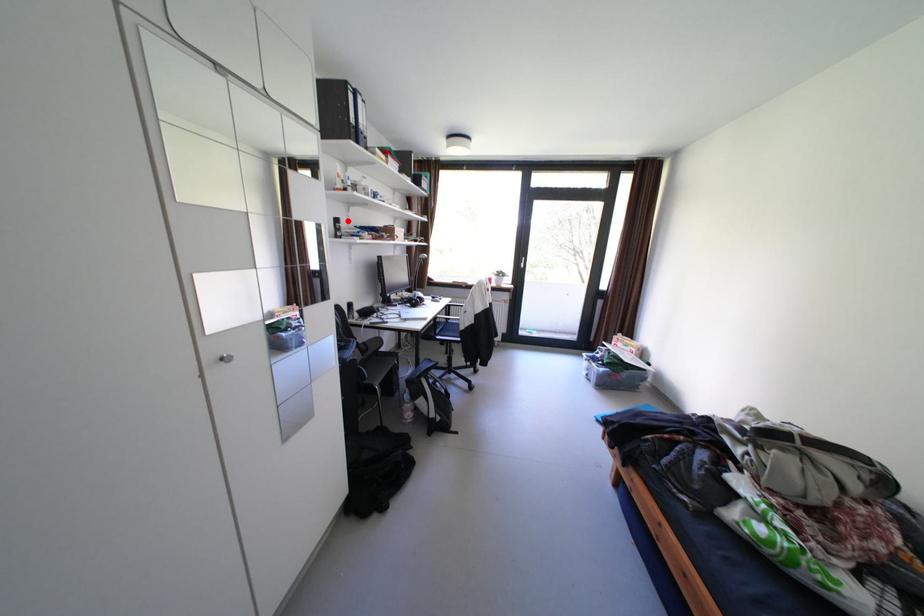
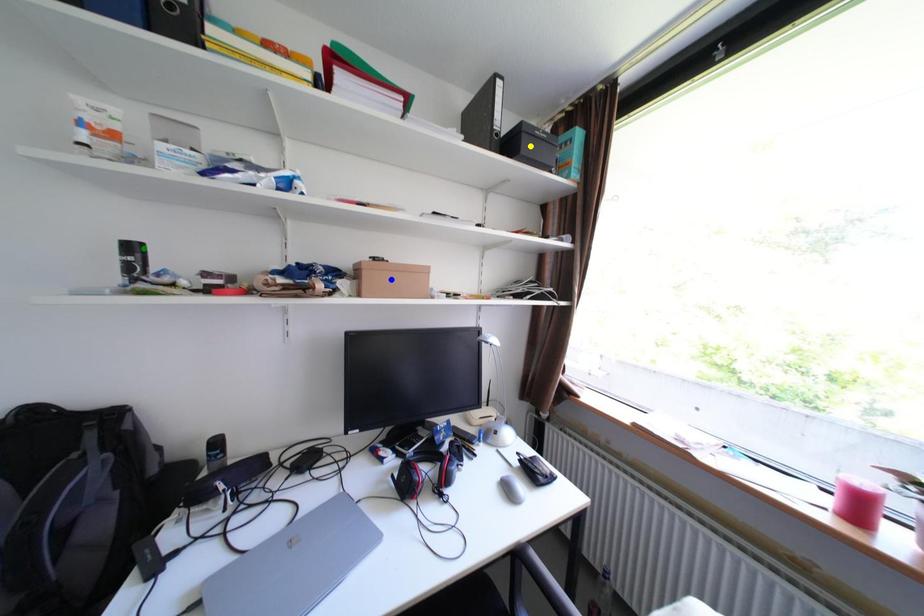
Question: I am providing you with two images of the same scene from different viewpoints. A red point is marked on the first image. You are given multiple points on the second image. Which spot in image 2 lines up with the point in image 1?

Choices:
 (A) yellow point
 (B) green point
 (C) blue point

Answer: (B)